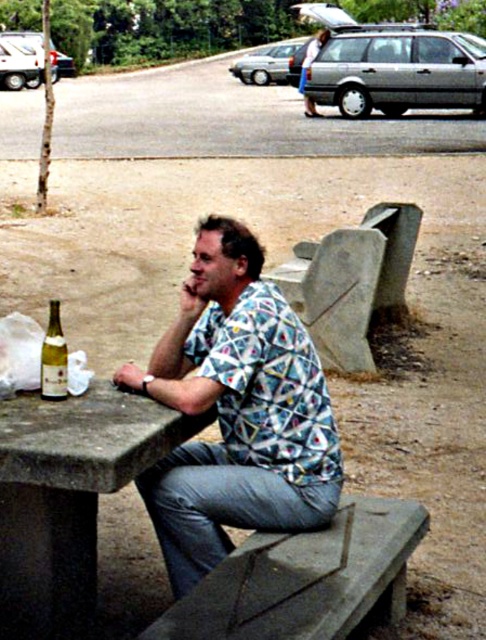
You are sitting on the concrete bench at lower center and want to place your phone on the concrete table at center. Is the table surface lower than the bench surface?

The concrete table at center is shorter than the concrete bench at lower center, so the table surface is lower than the bench surface. You can place your phone on the concrete table at center, but you will need to reach downward to do so.